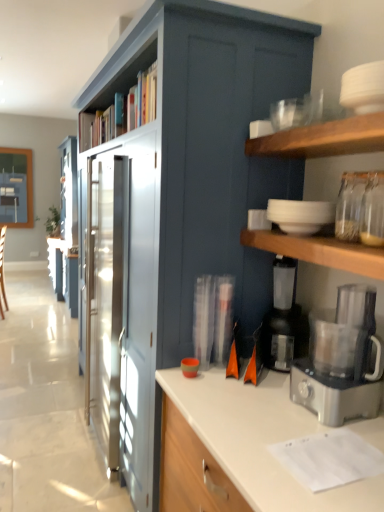
Question: Is wooden bookshelf at upper center surrounded by white matte bowls at upper right, the first appliance when ordered from top to bottom?

Choices:
 (A) no
 (B) yes

Answer: (A)

Question: From a real-world perspective, is white matte bowls at upper right, the 2th appliance ordered from the bottom, physically above wooden bookshelf at upper center?

Choices:
 (A) yes
 (B) no

Answer: (B)

Question: Are white matte bowls at upper right, the first appliance when ordered from top to bottom, and wooden bookshelf at upper center located far from each other?

Choices:
 (A) yes
 (B) no

Answer: (A)

Question: Considering the relative sizes of white matte bowls at upper right, the 2th appliance ordered from the bottom, and wooden bookshelf at upper center in the image provided, is white matte bowls at upper right, the 2th appliance ordered from the bottom, wider than wooden bookshelf at upper center?

Choices:
 (A) yes
 (B) no

Answer: (B)

Question: Is white matte bowls at upper right, the first appliance when ordered from top to bottom, at the left side of wooden bookshelf at upper center?

Choices:
 (A) no
 (B) yes

Answer: (A)

Question: Considering the positions of satin blue cabinet at center and satin silver food processor at right in the image, is satin blue cabinet at center bigger or smaller than satin silver food processor at right?

Choices:
 (A) small
 (B) big

Answer: (B)

Question: In terms of height, does satin blue cabinet at center look taller or shorter compared to satin silver food processor at right?

Choices:
 (A) tall
 (B) short

Answer: (A)

Question: Is satin blue cabinet at center wider or thinner than satin silver food processor at right?

Choices:
 (A) thin
 (B) wide

Answer: (B)

Question: From the image's perspective, is satin blue cabinet at center above or below satin silver food processor at right?

Choices:
 (A) below
 (B) above

Answer: (B)

Question: Does point (132, 77) appear closer or farther from the camera than point (306, 203)?

Choices:
 (A) closer
 (B) farther

Answer: (B)

Question: From their relative heights in the image, would you say wooden bookshelf at upper center is taller or shorter than white matte bowls at upper right, the 2th appliance ordered from the bottom?

Choices:
 (A) short
 (B) tall

Answer: (B)

Question: From the image's perspective, is wooden bookshelf at upper center above or below white matte bowls at upper right, the 2th appliance ordered from the bottom?

Choices:
 (A) below
 (B) above

Answer: (B)

Question: From a real-world perspective, is wooden bookshelf at upper center physically located above or below white matte bowls at upper right, the 2th appliance ordered from the bottom?

Choices:
 (A) above
 (B) below

Answer: (A)

Question: In terms of size, does satin silver food processor at right appear bigger or smaller than wooden bookshelf at upper center?

Choices:
 (A) big
 (B) small

Answer: (B)

Question: Is point (382, 373) closer or farther from the camera than point (100, 93)?

Choices:
 (A) closer
 (B) farther

Answer: (A)